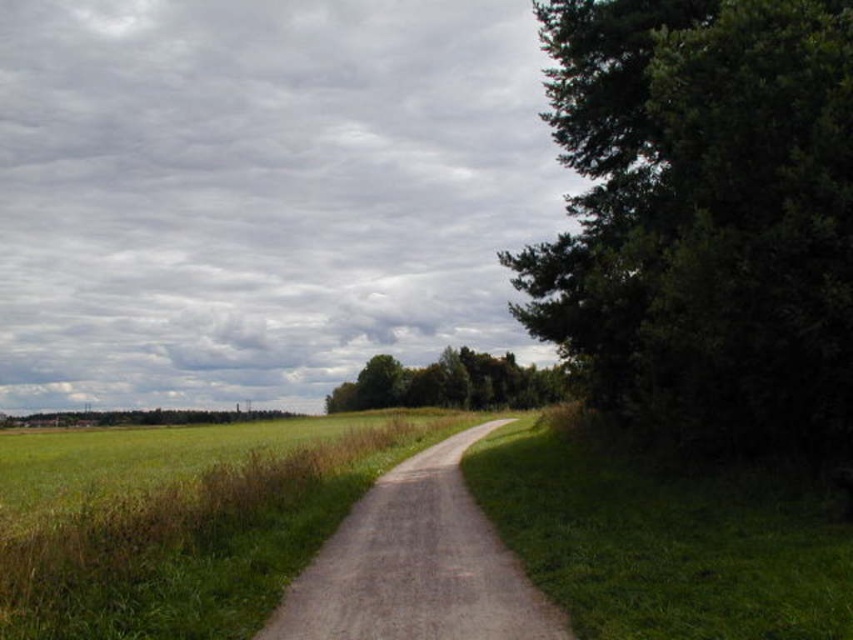
This screenshot has width=853, height=640. Find the location of `dirt/gravel path at center`. dirt/gravel path at center is located at coordinates (416, 564).

Between point (335, 579) and point (451, 396), which one is positioned in front?

Point (335, 579) is in front.

Is point (451, 592) farther from camera compared to point (430, 403)?

No, (451, 592) is in front of (430, 403).

I want to click on dirt/gravel path at center, so click(416, 564).

Between point (811, 115) and point (514, 385), which one is positioned behind?

Point (514, 385)

Consider the image. Who is taller, green leafy tree at right or green leafy trees at center?

green leafy tree at right is taller.

Is point (538, 317) closer to camera compared to point (514, 406)?

That is True.

Where is `green leafy tree at right`? Image resolution: width=853 pixels, height=640 pixels. green leafy tree at right is located at coordinates (704, 216).

Does green leafy tree at right have a greater width compared to dirt/gravel path at center?

Yes.

Between green leafy tree at right and dirt/gravel path at center, which one is positioned lower?

Positioned lower is dirt/gravel path at center.

Where is `green leafy tree at right`? green leafy tree at right is located at coordinates (704, 216).